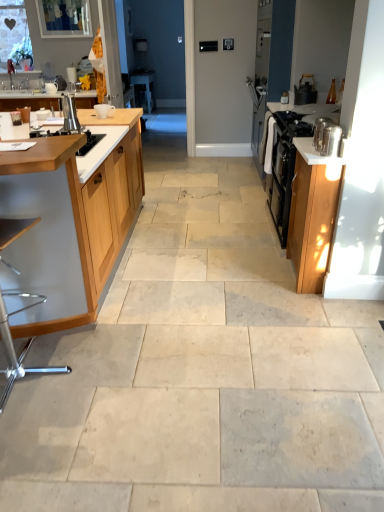
What is the approximate width of metallic silver containers at right?

10.69 inches.

You are a GUI agent. You are given a task and a screenshot of the screen. Output one action in this format:
    pyautogui.click(x=<x>, y=<y>)
    Task: Click on the metallic silver containers at right
    The width and height of the screenshot is (384, 512).
    Given the screenshot: What is the action you would take?
    314,153

Locate an element on the screen. white glossy countertop at upper left is located at coordinates (27, 94).

The height and width of the screenshot is (512, 384). Describe the element at coordinates (312, 214) in the screenshot. I see `glossy wood cabinet at right, acting as the second cabinetry starting from the left` at that location.

Image resolution: width=384 pixels, height=512 pixels. Find the location of `metallic silver bar stool at left`. metallic silver bar stool at left is located at coordinates (23, 348).

From a real-world perspective, is metallic silver containers at right beneath beige stone floor at center?

No, from a real-world perspective, metallic silver containers at right is not below beige stone floor at center.

Is metallic silver containers at right completely or partially outside of beige stone floor at center?

metallic silver containers at right lies outside beige stone floor at center's area.

Is metallic silver containers at right bigger or smaller than beige stone floor at center?

Considering their sizes, metallic silver containers at right takes up less space than beige stone floor at center.

In the scene shown: Does metallic silver containers at right have a greater width compared to beige stone floor at center?

In fact, metallic silver containers at right might be narrower than beige stone floor at center.

Can you confirm if matte black kettle at upper right is bigger than metallic silver bar stool at left?

No, matte black kettle at upper right is not bigger than metallic silver bar stool at left.

From the image's perspective, is matte black kettle at upper right beneath metallic silver bar stool at left?

No.

Consider the image. From a real-world perspective, relative to metallic silver bar stool at left, is matte black kettle at upper right vertically above or below?

matte black kettle at upper right is above metallic silver bar stool at left.

Could metallic silver bar stool at left be considered to be inside matte black kettle at upper right?

No, matte black kettle at upper right does not contain metallic silver bar stool at left.

In terms of height, does wooden cabinet at left, which appears as the 1th cabinetry when viewed from the left, look taller or shorter compared to white glossy table at center?

Clearly, wooden cabinet at left, which appears as the 1th cabinetry when viewed from the left, is taller compared to white glossy table at center.

Relative to white glossy table at center, is wooden cabinet at left, the second cabinetry viewed from the right, in front or behind?

wooden cabinet at left, the second cabinetry viewed from the right, is in front of white glossy table at center.

From the image's perspective, would you say wooden cabinet at left, the second cabinetry viewed from the right, is shown under white glossy table at center?

Yes.

Considering the relative sizes of metallic silver containers at right and wooden cabinet at left, the second cabinetry viewed from the right, in the image provided, is metallic silver containers at right wider than wooden cabinet at left, the second cabinetry viewed from the right,?

No.

Is point (298, 147) positioned behind point (108, 173)?

Yes, point (298, 147) is farther from viewer.

From their relative heights in the image, would you say metallic silver containers at right is taller or shorter than wooden cabinet at left, which appears as the 1th cabinetry when viewed from the left?

In the image, metallic silver containers at right appears to be shorter than wooden cabinet at left, which appears as the 1th cabinetry when viewed from the left.

At what (x,y) coordinates should I click in order to perform the action: click on the 1st cabinetry below the metallic silver containers at right (from the image's perspective). Please return your answer as a coordinate pair (x, y). Looking at the image, I should click on (70, 222).

Would you say metallic silver bar stool at left is to the left or to the right of white glossy table at center in the picture?

metallic silver bar stool at left is to the right of white glossy table at center.

Identify the location of table beneath the metallic silver bar stool at left (from a real-world perspective). This screenshot has width=384, height=512. (143, 88).

Which object is wider, metallic silver bar stool at left or white glossy table at center?

With larger width is metallic silver bar stool at left.

From the image's perspective, which is below, matte silver sink at left or metallic silver canister at right, which is counted as the first appliance, starting from the right?

metallic silver canister at right, which is counted as the first appliance, starting from the right.

Which object is further away from the camera taking this photo, matte silver sink at left or metallic silver canister at right, marked as the second appliance in a top-to-bottom arrangement?

matte silver sink at left is more distant.

Is matte silver sink at left located outside metallic silver canister at right, acting as the 1th appliance starting from the front?

Yes, matte silver sink at left is outside of metallic silver canister at right, acting as the 1th appliance starting from the front.

Is metallic silver canister at right, acting as the 2th appliance starting from the back, not close to wooden cabinet at left, the second cabinetry viewed from the right?

That's right, there is a large distance between metallic silver canister at right, acting as the 2th appliance starting from the back, and wooden cabinet at left, the second cabinetry viewed from the right.

Which object is more forward, metallic silver canister at right, which is counted as the first appliance, starting from the right, or wooden cabinet at left, which appears as the 1th cabinetry when viewed from the left?

wooden cabinet at left, which appears as the 1th cabinetry when viewed from the left, is closer to the camera.

Considering the relative sizes of metallic silver canister at right, which is counted as the first appliance, starting from the right, and wooden cabinet at left, which appears as the 1th cabinetry when viewed from the left, in the image provided, is metallic silver canister at right, which is counted as the first appliance, starting from the right, wider than wooden cabinet at left, which appears as the 1th cabinetry when viewed from the left,?

Incorrect, the width of metallic silver canister at right, which is counted as the first appliance, starting from the right, does not surpass that of wooden cabinet at left, which appears as the 1th cabinetry when viewed from the left.

Where is `counter top above the beige stone floor at center (from the image's perspective)`? Image resolution: width=384 pixels, height=512 pixels. counter top above the beige stone floor at center (from the image's perspective) is located at coordinates (314, 153).

At what (x,y) coordinates should I click in order to perform the action: click on bar stool below the matte black kettle at upper right (from the image's perspective). Please return your answer as a coordinate pair (x, y). Looking at the image, I should click on (23, 348).

Which object lies further to the anchor point matte silver sink at left, clear glass window at upper left or beige stone floor at center?

The object further to matte silver sink at left is beige stone floor at center.

When comparing their distances from wooden cabinet at left, the second cabinetry viewed from the right, does metallic silver canister at right, which is counted as the first appliance, starting from the right, or glossy wood cabinet at right, which appears as the 1th cabinetry when viewed from the right, seem closer?

Among the two, glossy wood cabinet at right, which appears as the 1th cabinetry when viewed from the right, is located nearer to wooden cabinet at left, the second cabinetry viewed from the right.

When comparing their distances from clear glass window at upper left, does metallic silver canister at right, which is counted as the first appliance, starting from the right, or white glossy table at center seem further?

The object further to clear glass window at upper left is metallic silver canister at right, which is counted as the first appliance, starting from the right.

Which object lies further to the anchor point transparent glass screen door at center, metallic silver containers at right or white glossy table at center?

metallic silver containers at right.

Estimate the real-world distances between objects in this image. Which object is further from metallic silver bar stool at left, matte black kettle at upper right or metallic silver canister at right, acting as the 2th appliance starting from the back?

matte black kettle at upper right.

Based on their spatial positions, is wooden cabinet at left, the second cabinetry viewed from the right, or clear glass window at upper left closer to metallic silver canister at right, which is counted as the first appliance, starting from the right?

The object closer to metallic silver canister at right, which is counted as the first appliance, starting from the right, is wooden cabinet at left, the second cabinetry viewed from the right.

Consider the image. Which object lies nearer to the anchor point glossy wood cabinet at right, which appears as the 1th cabinetry when viewed from the right, matte silver sink at left or metallic silver containers at right?

metallic silver containers at right is closer to glossy wood cabinet at right, which appears as the 1th cabinetry when viewed from the right.

Estimate the real-world distances between objects in this image. Which object is further from white glossy table at center, wooden cabinet at left, the second cabinetry viewed from the right, or white glossy countertop at upper left?

wooden cabinet at left, the second cabinetry viewed from the right.

Find the location of a particular element. The height and width of the screenshot is (512, 384). kitchen appliance located between metallic silver bar stool at left and white glossy table at center in the depth direction is located at coordinates (305, 90).

Locate an element on the screen. Image resolution: width=384 pixels, height=512 pixels. screen door between metallic silver bar stool at left and matte silver sink at left from front to back is located at coordinates point(158,48).

The width and height of the screenshot is (384, 512). Identify the location of countertop between beige stone floor at center and transparent glass screen door at center along the z-axis. (27, 94).

Image resolution: width=384 pixels, height=512 pixels. What are the coordinates of `screen door between metallic silver containers at right and clear glass window at upper left along the z-axis` in the screenshot? It's located at (158, 48).